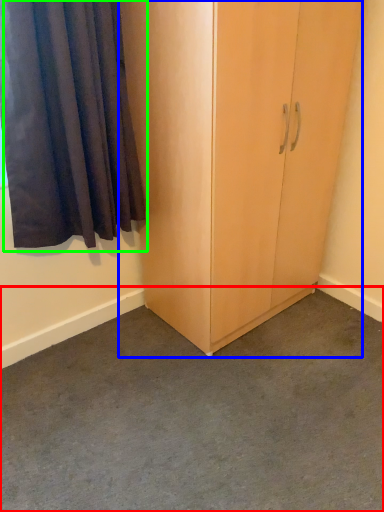
Question: Estimate the real-world distances between objects in this image. Which object is farther from concrete (highlighted by a red box), cupboard (highlighted by a blue box) or curtain (highlighted by a green box)?

Choices:
 (A) cupboard
 (B) curtain

Answer: (B)